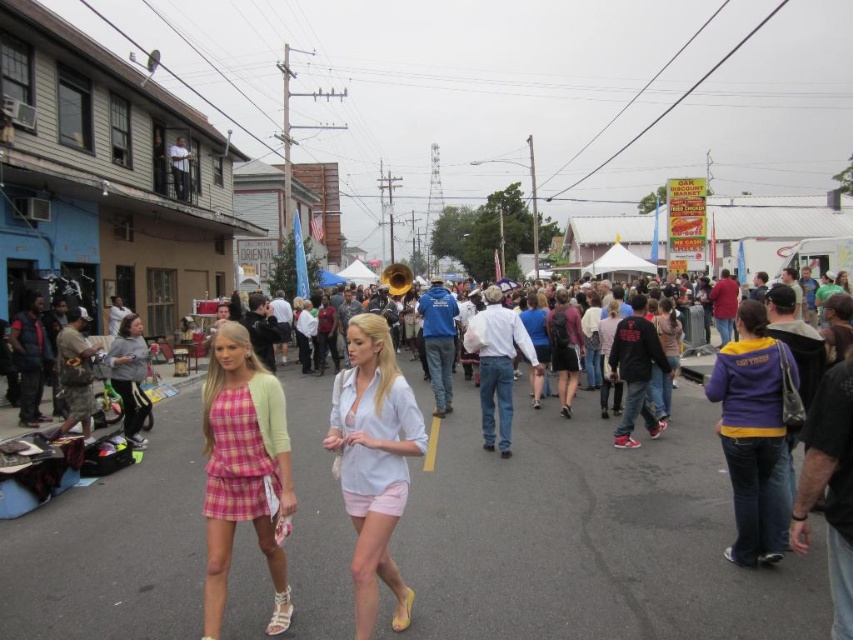
Does pink plaid skirt at center have a lesser width compared to purple/yellow sweater at right?

Incorrect, pink plaid skirt at center's width is not less than purple/yellow sweater at right's.

Between pink plaid skirt at center and purple/yellow sweater at right, which one is positioned lower?

Positioned lower is pink plaid skirt at center.

Is point (245, 401) positioned behind point (767, 518)?

No, it is not.

Find the location of `pink plaid skirt at center`. pink plaid skirt at center is located at coordinates (242, 470).

In the scene shown: Between pink plaid skirt at center and gray fleece sweatshirt at left, which one has more height?

pink plaid skirt at center

Where is `pink plaid skirt at center`? pink plaid skirt at center is located at coordinates (242, 470).

Where is `pink plaid skirt at center`? The image size is (853, 640). pink plaid skirt at center is located at coordinates (242, 470).

Is light pink cotton shorts at center wider than purple/yellow sweater at right?

Indeed, light pink cotton shorts at center has a greater width compared to purple/yellow sweater at right.

The width and height of the screenshot is (853, 640). I want to click on light pink cotton shorts at center, so click(x=374, y=461).